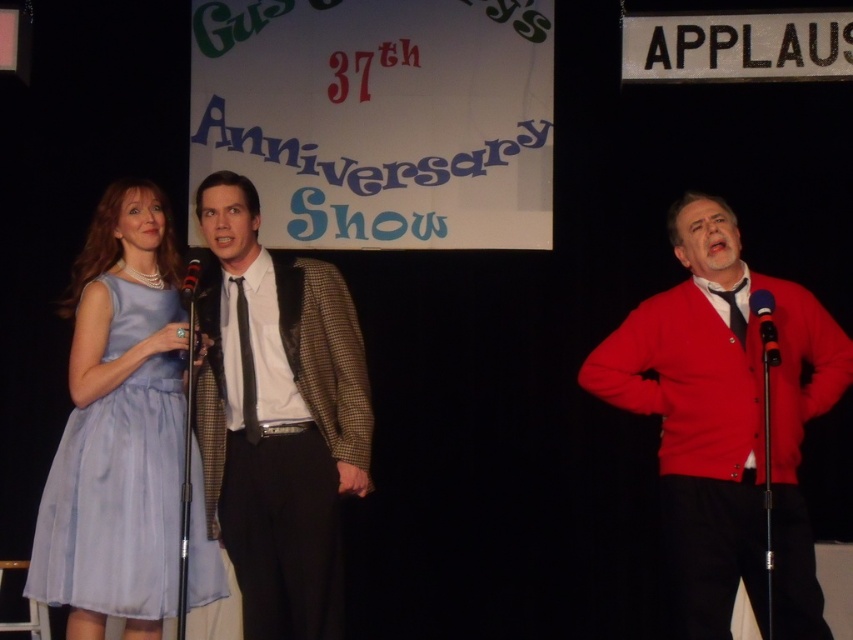
Based on the description, which clothing item is narrower between the houndstooth fabric blazer at center and the red cardigan at right?

The houndstooth fabric blazer at center is thinner than the red cardigan at right, so the houndstooth fabric blazer at center is narrower.

In the stage performance scene of the 37th Anniversary Show, there is a light blue chiffon dress at left and a blue metallic microphone at right. Which object is bigger?

The light blue chiffon dress at left is larger than the blue metallic microphone at right.

Based on the scene description, can you determine the spatial relationship between the light blue chiffon dress at left and the blue metallic microphone at right?

The blue metallic microphone at right is behind the light blue chiffon dress at left.